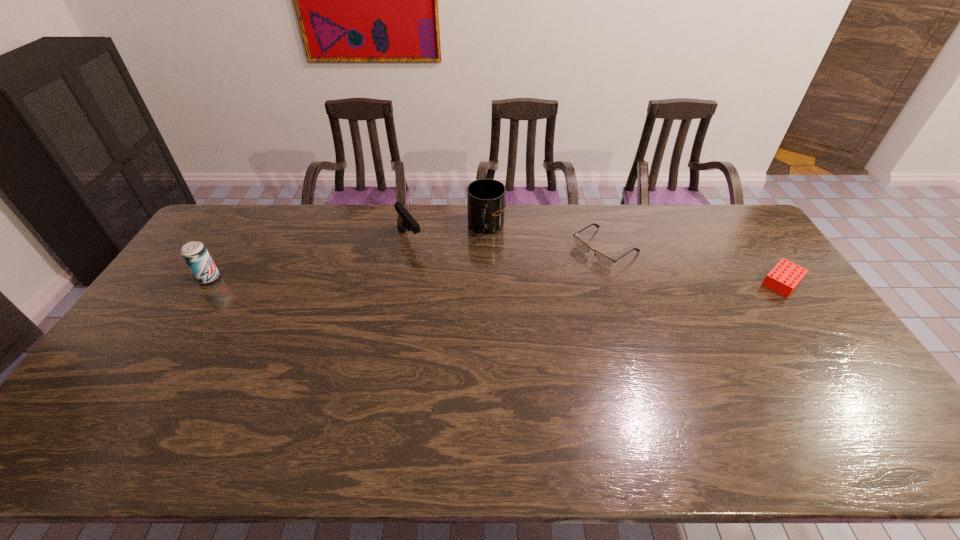
The width and height of the screenshot is (960, 540). In order to click on vacant space on the desktop that is between the beer can and the rightmost object and is positioned on the front-facing side of the second object from left to right in this screenshot , I will do `click(442, 280)`.

Identify the location of free spot on the desktop that is between the leftmost object and the Lego and is positioned on the front-facing side of the spectacles. coord(556,280).

Where is `vacant space on the desktop that is between the beer can and the Lego and is positioned with the handle on the side of the mug`? vacant space on the desktop that is between the beer can and the Lego and is positioned with the handle on the side of the mug is located at coordinates (455, 280).